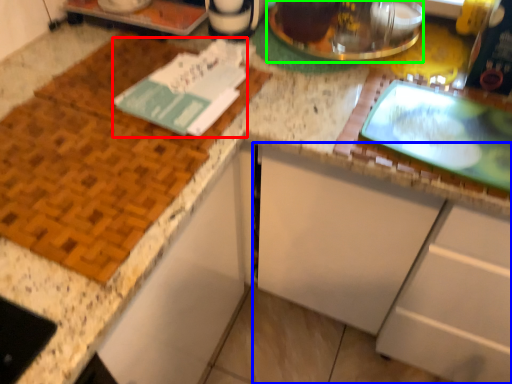
Question: Which object is positioned farthest from journal (highlighted by a red box)? Select from cabinetry (highlighted by a blue box) and appliance (highlighted by a green box).

Choices:
 (A) cabinetry
 (B) appliance

Answer: (A)